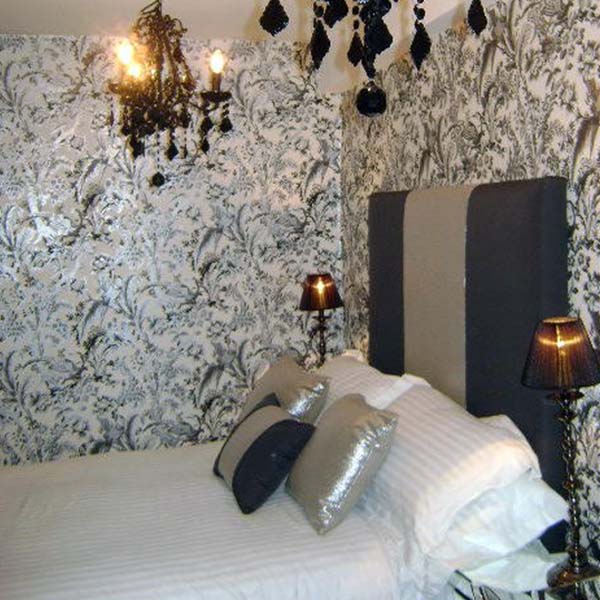
At what (x,y) coordinates should I click in order to perform the action: click on pillow. Please return your answer as a coordinate pair (x, y). Looking at the image, I should click on (350, 385).